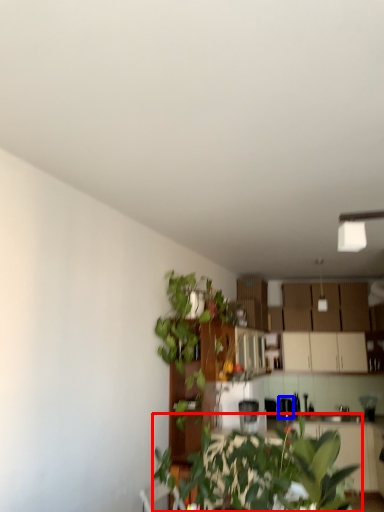
Question: Among these objects, which one is nearest to the camera, houseplant (highlighted by a red box) or appliance (highlighted by a blue box)?

Choices:
 (A) houseplant
 (B) appliance

Answer: (A)